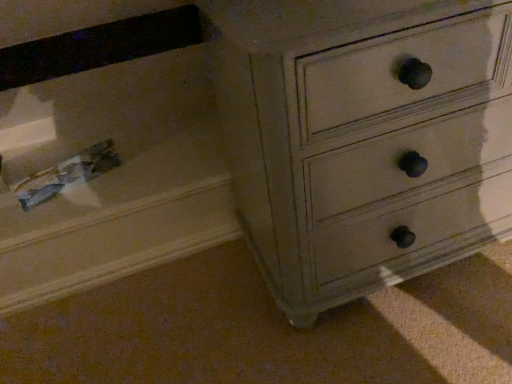
The height and width of the screenshot is (384, 512). Identify the location of blank space situated above clear plastic drawer at lower left, the first drawer when ordered from left to right (from a real-world perspective). (100, 170).